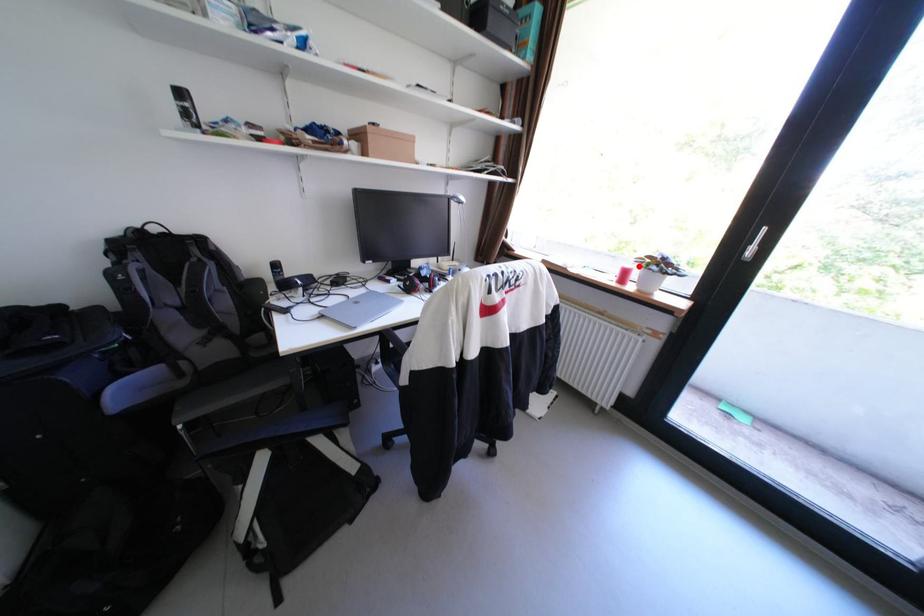
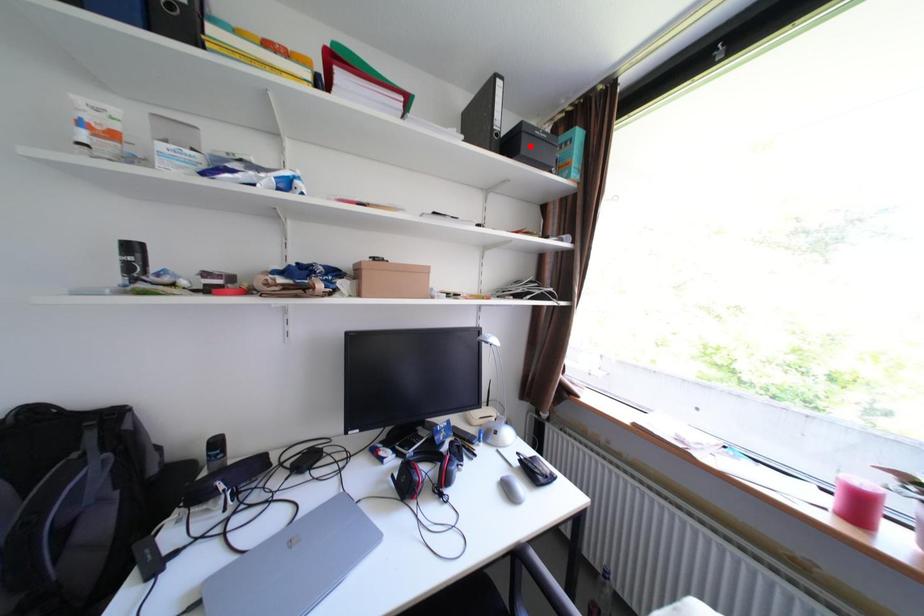
I am providing you with two images of the same scene from different viewpoints. A red point is marked on the first image and another point is marked on the second image. Are the points marked in image1 and image2 representing the same 3D position?

No